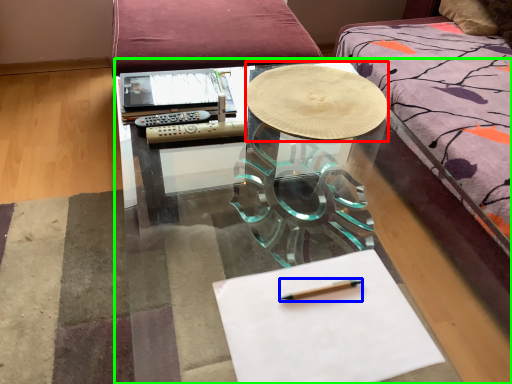
Question: Which is nearer to the round table (highlighted by a red box)? pencil (highlighted by a blue box) or table (highlighted by a green box).

Choices:
 (A) pencil
 (B) table

Answer: (B)